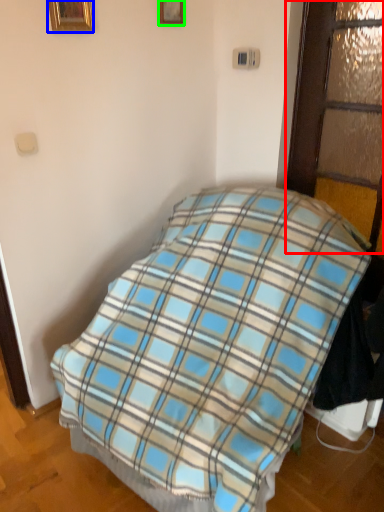
Question: Estimate the real-world distances between objects in this image. Which object is closer to glass door (highlighted by a red box), picture frame (highlighted by a blue box) or picture frame (highlighted by a green box)?

Choices:
 (A) picture frame
 (B) picture frame

Answer: (B)